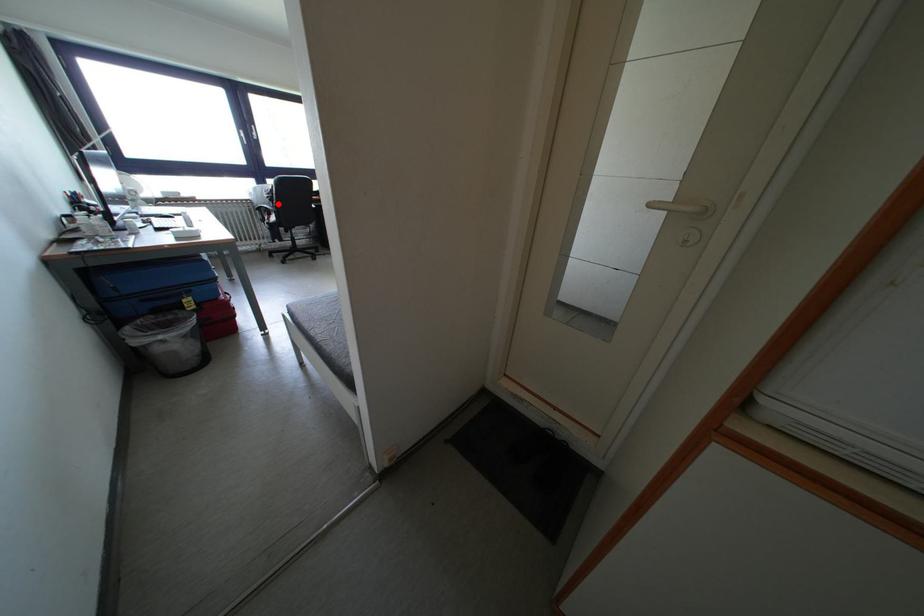
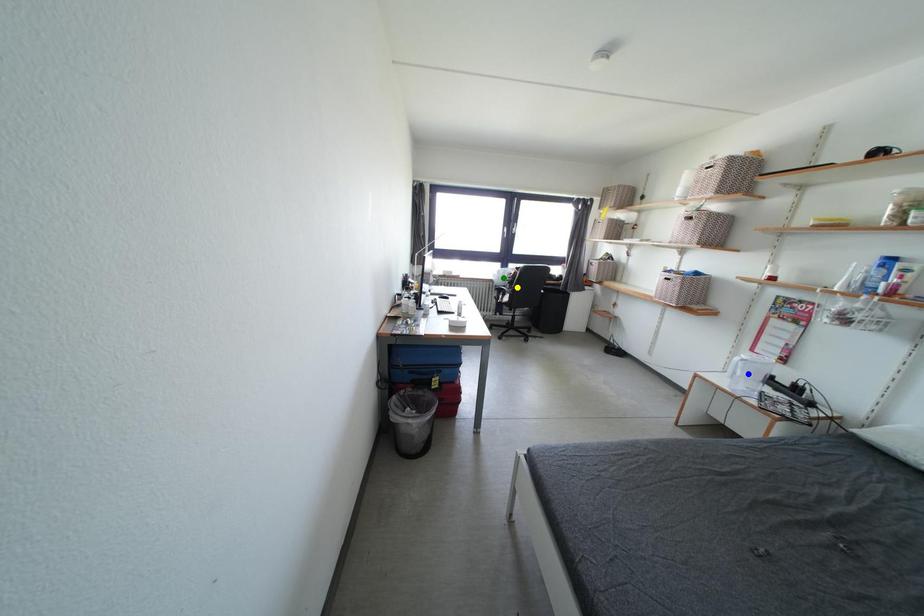
Question: I am providing you with two images of the same scene from different viewpoints. A red point is marked on the first image. You are given multiple points on the second image. In image 2, which mark is for the same physical point as the one in image 1?

Choices:
 (A) blue point
 (B) yellow point
 (C) green point

Answer: (B)